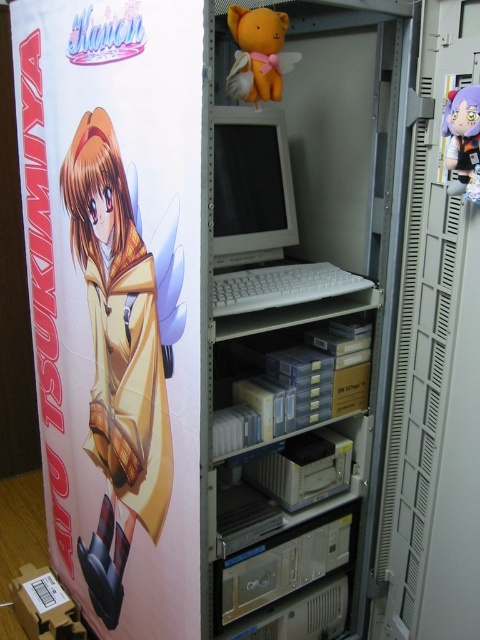
Question: Among these points, which one is nearest to the camera?

Choices:
 (A) (280, 180)
 (B) (86, 257)

Answer: (B)

Question: Estimate the real-world distances between objects in this image. Which object is closer to the matte white monitor at center?

Choices:
 (A) matte yellow plush at upper center
 (B) plush purple doll at right

Answer: (A)

Question: Is matte paper poster at left positioned before matte yellow plush at upper center?

Choices:
 (A) no
 (B) yes

Answer: (B)

Question: Is matte paper poster at left bigger than plush purple doll at right?

Choices:
 (A) no
 (B) yes

Answer: (B)

Question: Which of the following is the closest to the observer?

Choices:
 (A) (286, 60)
 (B) (233, 180)
 (C) (463, 108)

Answer: (C)

Question: Considering the relative positions of matte paper poster at left and matte yellow plush at upper center in the image provided, where is matte paper poster at left located with respect to matte yellow plush at upper center?

Choices:
 (A) left
 (B) right

Answer: (A)